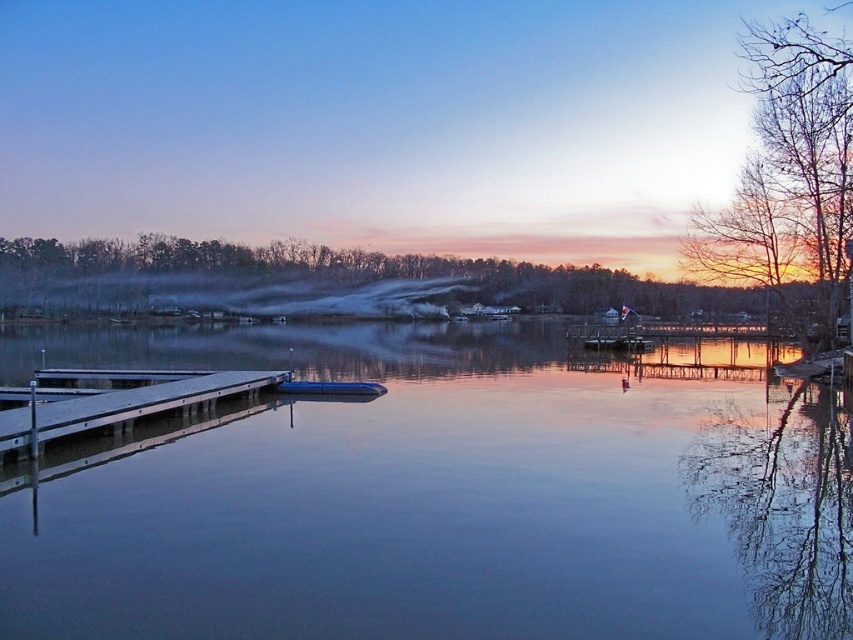
You are standing on the lakeside dock and want to take a photo of both the bare branches at right and the brown matte tree at upper center. Which object should you focus on first to ensure both are in clear view?

You should focus on the bare branches at right first because it is closer to the viewer than the brown matte tree at upper center, so adjusting focus from near to far will help both be in clear view.

You are standing at the lakeside and want to walk from point (782, 227) to point (213, 380). Which direction should you move to get closer to your destination?

You should move downward and to the right because point (213, 380) is located lower and to the right compared to point (782, 227).